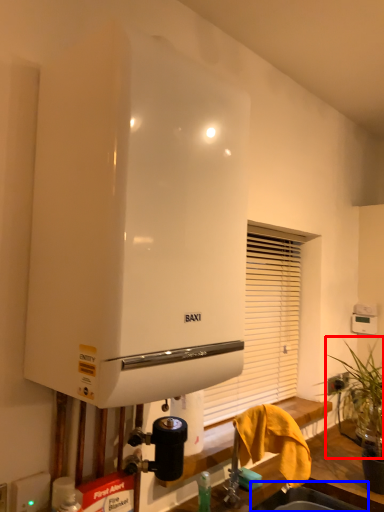
Question: Which of the following is the closest to the observer, plant (highlighted by a red box) or sink (highlighted by a blue box)?

Choices:
 (A) plant
 (B) sink

Answer: (B)